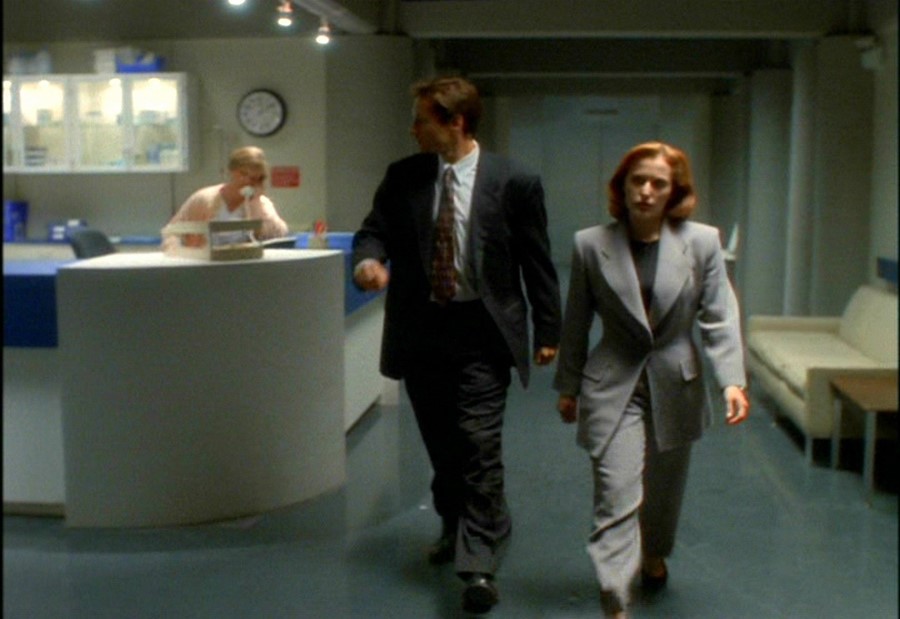
Where is `lights`? The image size is (900, 619). lights is located at coordinates (320, 39), (280, 20), (232, 0).